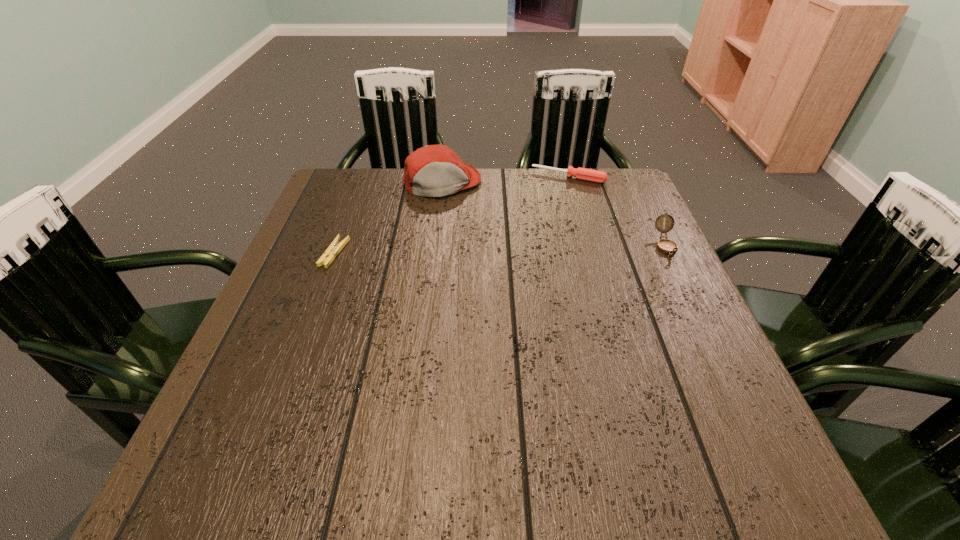
Image resolution: width=960 pixels, height=540 pixels. In order to click on the leftmost object in this screenshot , I will do `click(333, 250)`.

The height and width of the screenshot is (540, 960). What are the coordinates of `the shortest object` in the screenshot? It's located at (333, 250).

The image size is (960, 540). Identify the location of the rightmost object. pyautogui.click(x=668, y=247).

You are a GUI agent. You are given a task and a screenshot of the screen. Output one action in this format:
    pyautogui.click(x=<x>, y=<y>)
    Task: Click on the compass
    
    Given the screenshot: What is the action you would take?
    pyautogui.click(x=668, y=247)

Identify the location of the tallest object. [434, 170].

Locate an element on the screen. cap is located at coordinates point(434,170).

In order to click on screwdriver in this screenshot , I will do `click(585, 174)`.

The height and width of the screenshot is (540, 960). Identify the location of the second object from right to left. (585, 174).

The image size is (960, 540). I want to click on vacant space located 0.250m on the back of the shortest object, so click(360, 185).

At what (x,y) coordinates should I click in order to perform the action: click on vacant space located on the face of the third shortest object. Please return your answer as a coordinate pair (x, y). The width and height of the screenshot is (960, 540). Looking at the image, I should click on (699, 316).